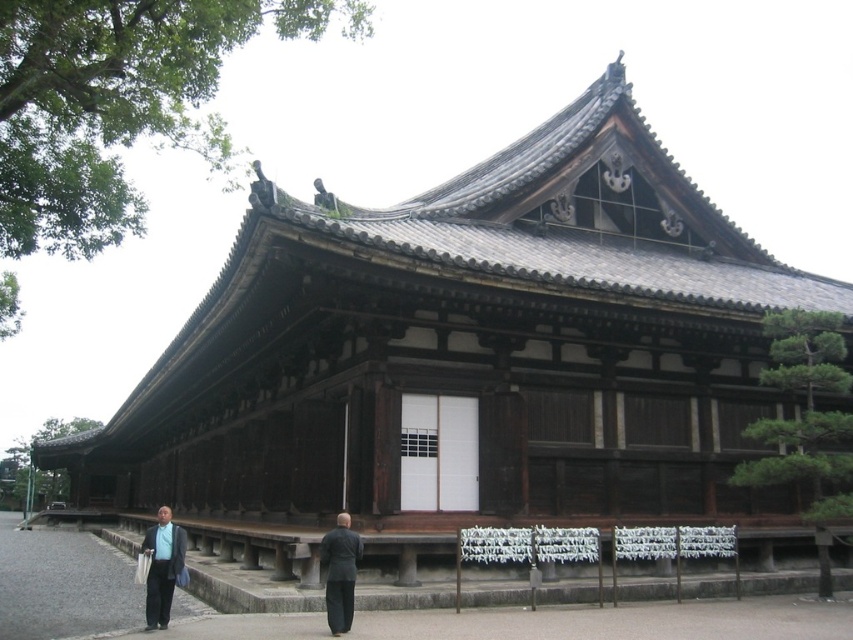
Can you confirm if matte black suit at lower left is positioned to the right of dark gray suit at center?

No, matte black suit at lower left is not to the right of dark gray suit at center.

Looking at this image, can you confirm if matte black suit at lower left is bigger than dark gray suit at center?

Yes.

Where is `matte black suit at lower left`? This screenshot has height=640, width=853. matte black suit at lower left is located at coordinates (161, 566).

Where is `matte black suit at lower left`? The image size is (853, 640). matte black suit at lower left is located at coordinates [x=161, y=566].